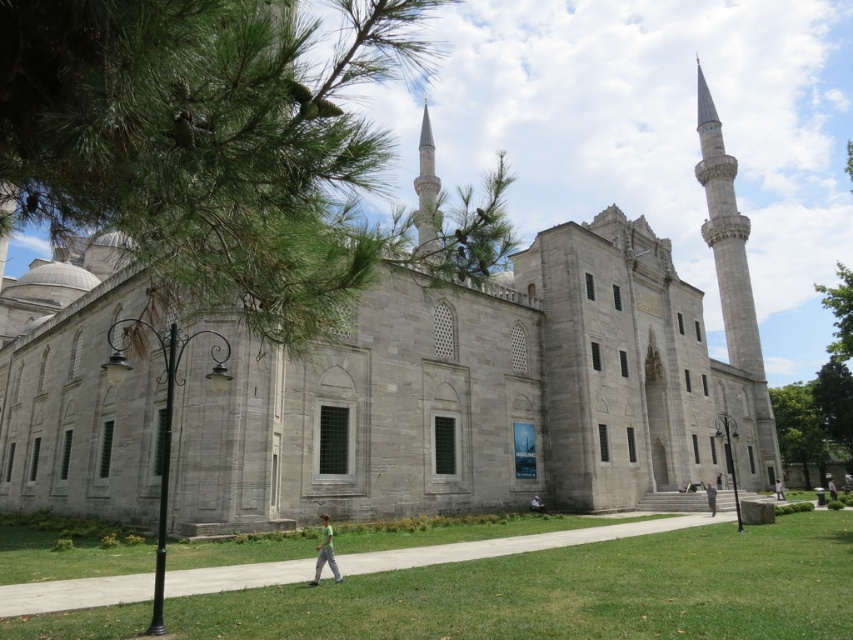
You are a tour guide leading a group to the mosque entrance. You see the green grass at lower center and the green fabric person at center. How far apart are these two landmarks from each other?

The green grass at lower center and the green fabric person at center are 68.12 meters apart from each other.

You are standing at the entrance of the grand mosque and want to walk towards the green grass at lower center. Is the green fabric person at center blocking your path?

The green grass at lower center is located above the green fabric person at center, meaning the person is positioned below the grass area. Since the grass is above the person, they are not blocking your path to the grass.